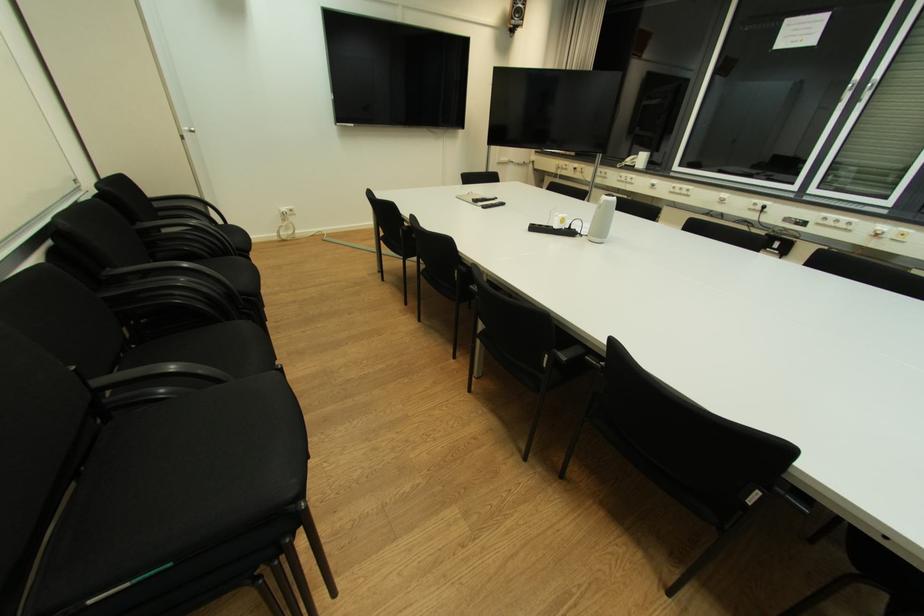
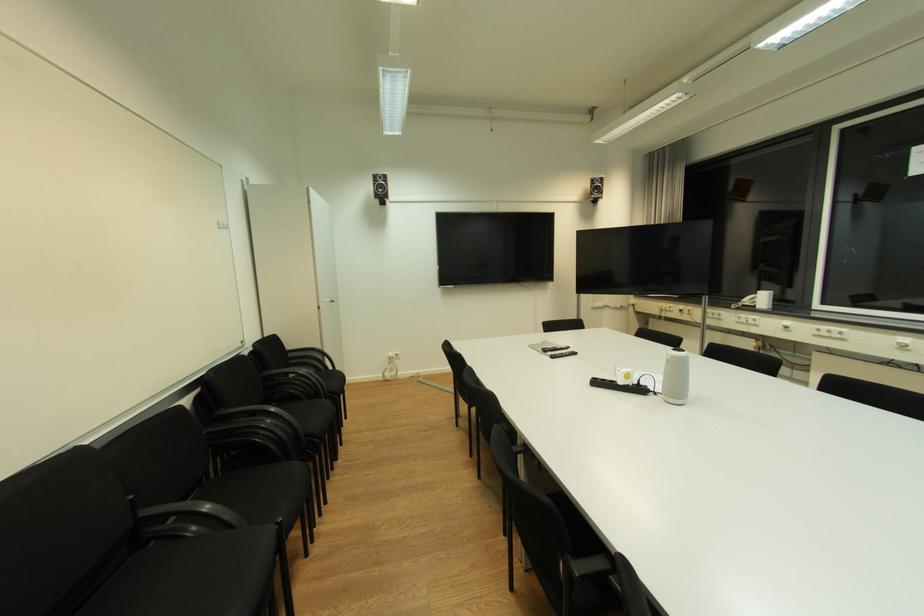
Where in the second image is the point corresponding to point (611, 203) from the first image?

(678, 358)